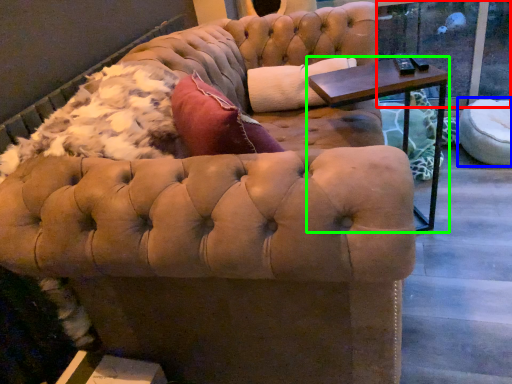
Question: Estimate the real-world distances between objects in this image. Which object is closer to window screen (highlighted by a red box), swivel chair (highlighted by a blue box) or table (highlighted by a green box)?

Choices:
 (A) swivel chair
 (B) table

Answer: (A)